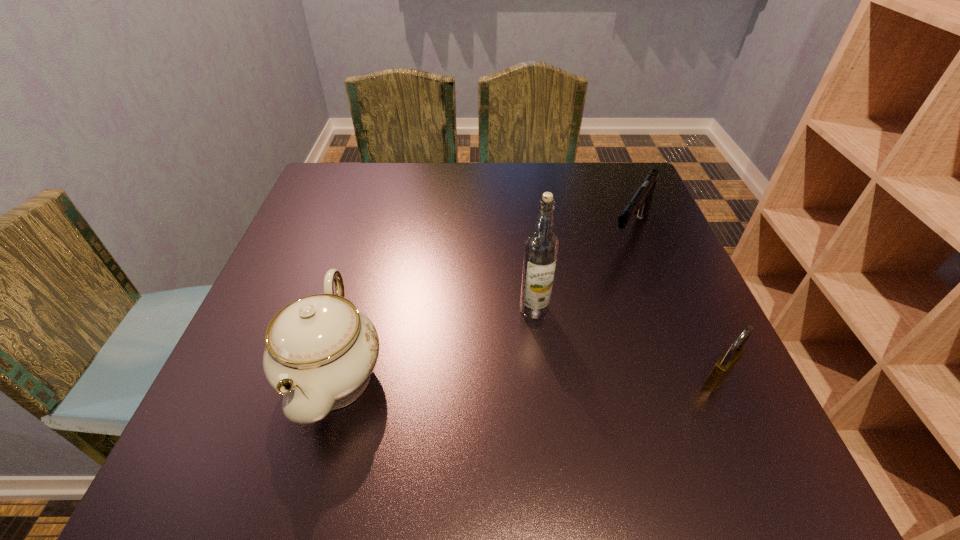
Locate an element on the screen. This screenshot has width=960, height=540. object that ranks as the third closest to the farthest object is located at coordinates (320, 352).

Find the location of a particular element. The image size is (960, 540). object that is the third closest to the second tallest object is located at coordinates (727, 361).

Where is `vacant region that satisfies the following two spatial constraints: 1. on the front side of the second object from left to right; 2. on the right side of the padlock`? The height and width of the screenshot is (540, 960). vacant region that satisfies the following two spatial constraints: 1. on the front side of the second object from left to right; 2. on the right side of the padlock is located at coordinates (542, 380).

Find the location of a particular element. free location that satisfies the following two spatial constraints: 1. on the front side of the padlock; 2. on the left side of the gun is located at coordinates (687, 380).

This screenshot has height=540, width=960. Identify the location of free location that satisfies the following two spatial constraints: 1. on the back side of the tallest object; 2. on the right side of the gun. (525, 233).

At what (x,y) coordinates should I click in order to perform the action: click on free space that satisfies the following two spatial constraints: 1. on the front side of the tallest object; 2. on the left side of the padlock. Please return your answer as a coordinate pair (x, y). Image resolution: width=960 pixels, height=540 pixels. Looking at the image, I should click on (542, 380).